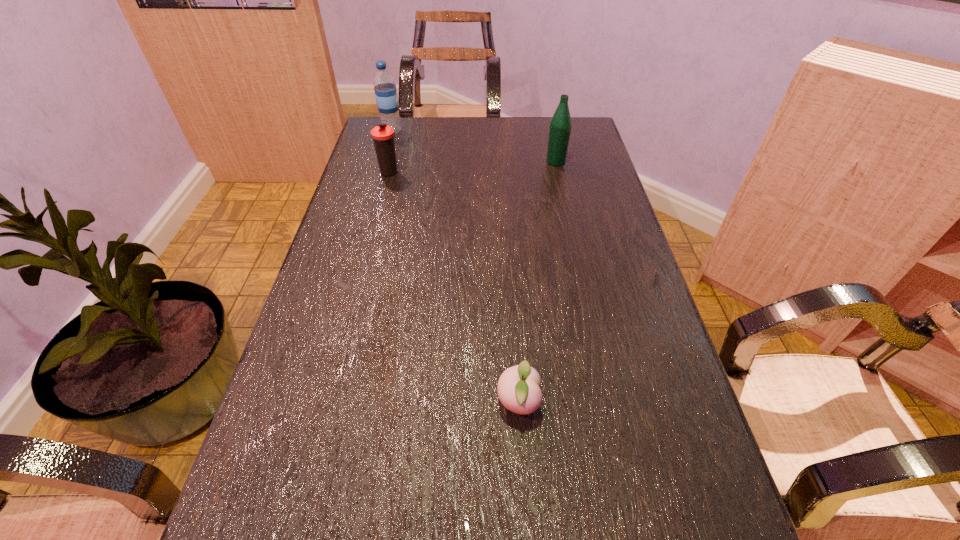
The height and width of the screenshot is (540, 960). What are the coordinates of `vacant space that satisfies the following two spatial constraints: 1. on the label of the third object from left to right; 2. on the left side of the farthest object` in the screenshot? It's located at (316, 403).